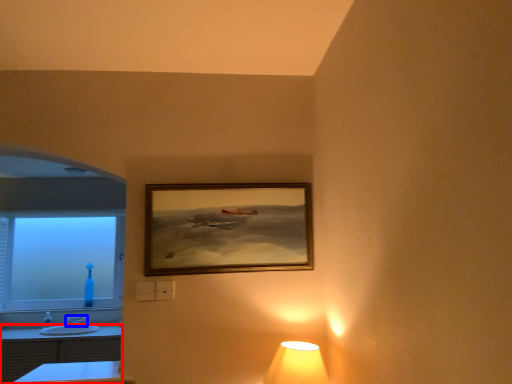
Question: Which point is closer to the camera, dresser (highlighted by a red box) or tap (highlighted by a blue box)?

Choices:
 (A) dresser
 (B) tap

Answer: (A)